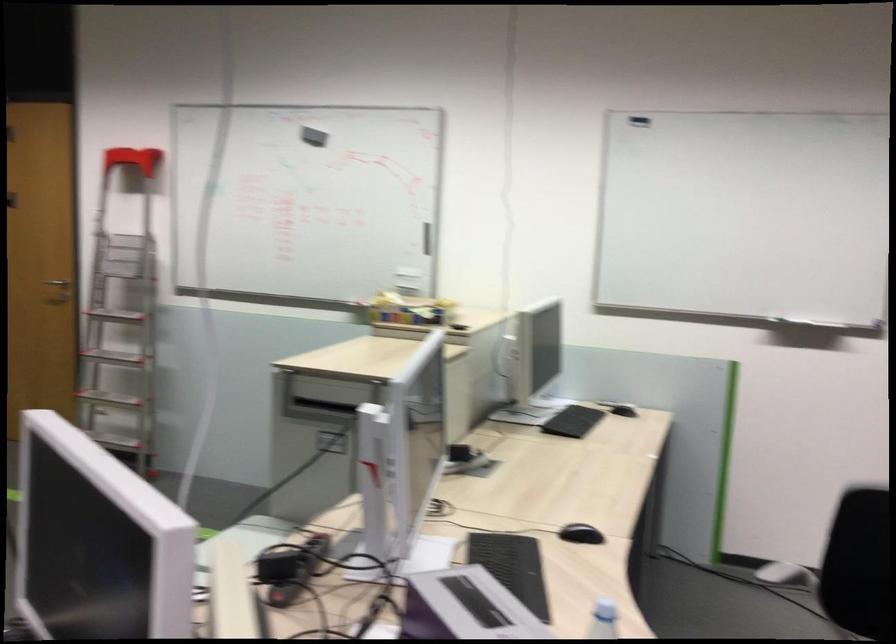
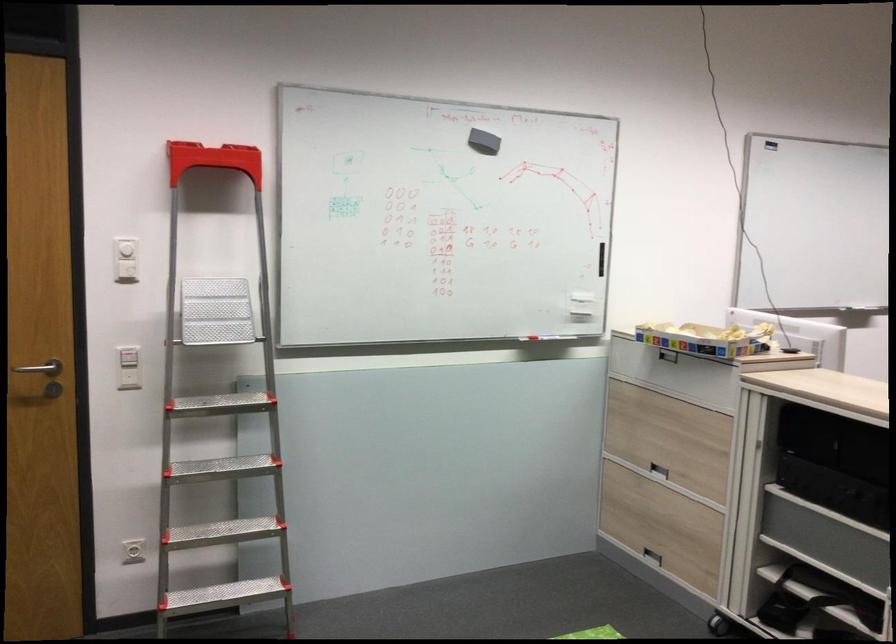
The point at (348, 134) is marked in the first image. Where is the corresponding point in the second image?

(483, 142)